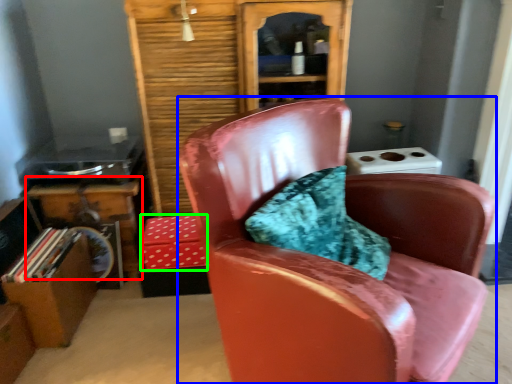
Question: Based on their relative distances, which object is farther from table (highlighted by a red box)? Choose from chair (highlighted by a blue box) and box (highlighted by a green box).

Choices:
 (A) chair
 (B) box

Answer: (A)